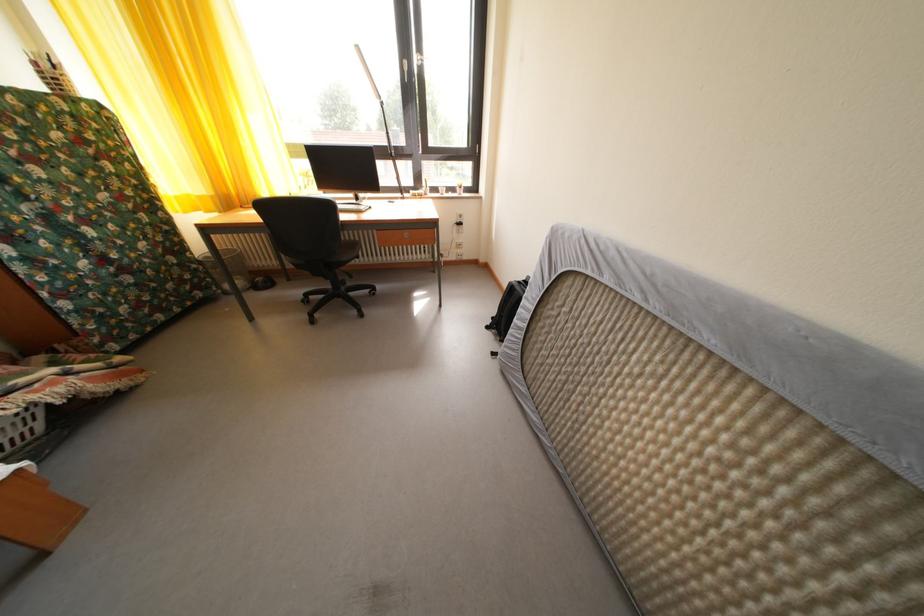
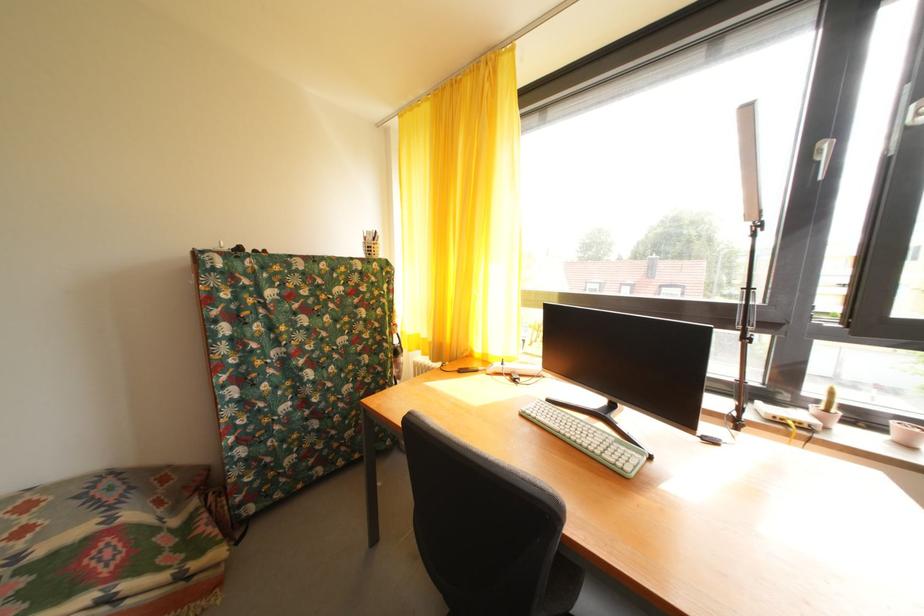
The point at (209, 204) is marked in the first image. Where is the corresponding point in the second image?

(432, 346)